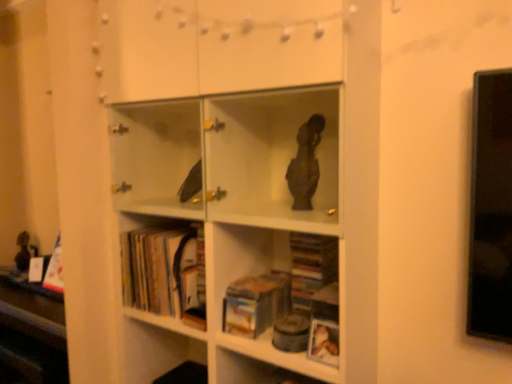
Question: Relative to hardcover book at center, which ranks as the second book in left-to-right order, is hardcover books at lower left, which is the 1th book in left-to-right order, in front or behind?

Choices:
 (A) front
 (B) behind

Answer: (B)

Question: Considering the relative positions of hardcover books at lower left, which is the 2th book in right-to-left order, and hardcover book at center, positioned as the first book in right-to-left order, in the image provided, is hardcover books at lower left, which is the 2th book in right-to-left order, to the left or to the right of hardcover book at center, positioned as the first book in right-to-left order,?

Choices:
 (A) right
 (B) left

Answer: (B)

Question: Estimate the real-world distances between objects in this image. Which object is closer to the white matte bookcase at center?

Choices:
 (A) hardcover books at lower left, which is the 2th book in right-to-left order
 (B) hardcover book at center, positioned as the first book in right-to-left order

Answer: (A)

Question: Which object is positioned farthest from the hardcover books at lower left, which is the 2th book in right-to-left order?

Choices:
 (A) white matte bookcase at center
 (B) hardcover book at center, positioned as the first book in right-to-left order

Answer: (B)